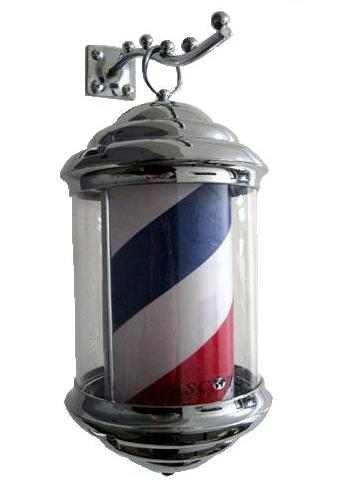
Image resolution: width=358 pixels, height=497 pixels. What are the coordinates of `tip of decoration` in the screenshot? It's located at (167, 474).